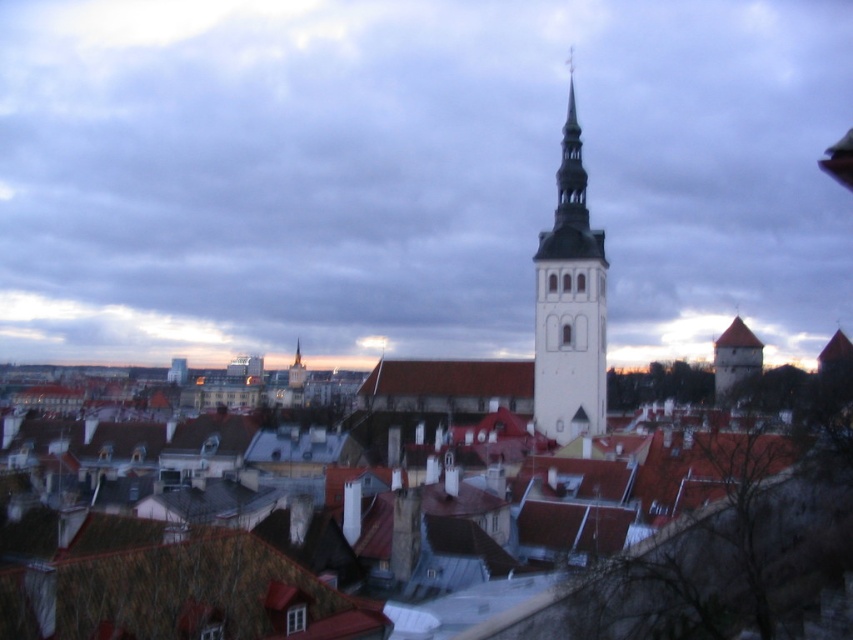
Is brown tile roofs at center above white stone bell tower at center?

Actually, brown tile roofs at center is below white stone bell tower at center.

Can you confirm if brown tile roofs at center is wider than white stone bell tower at center?

Correct, the width of brown tile roofs at center exceeds that of white stone bell tower at center.

Identify the location of brown tile roofs at center. (167, 586).

Is brown tile roof at center to the right of brown stone tower at right from the viewer's perspective?

No, brown tile roof at center is not to the right of brown stone tower at right.

Does brown tile roof at center appear over brown stone tower at right?

Indeed, brown tile roof at center is positioned over brown stone tower at right.

What are the coordinates of `brown tile roof at center` in the screenshot? It's located at (450, 378).

Based on the photo, is matte white tower at center positioned at the back of brown tile roof at center?

Yes, it is behind brown tile roof at center.

Who is positioned more to the left, matte white tower at center or brown tile roof at center?

From the viewer's perspective, matte white tower at center appears more on the left side.

Consider the image. Who is more distant from viewer, (x=68, y=268) or (x=495, y=376)?

The point (x=68, y=268) is more distant.

Locate an element on the screen. The width and height of the screenshot is (853, 640). matte white tower at center is located at coordinates (413, 176).